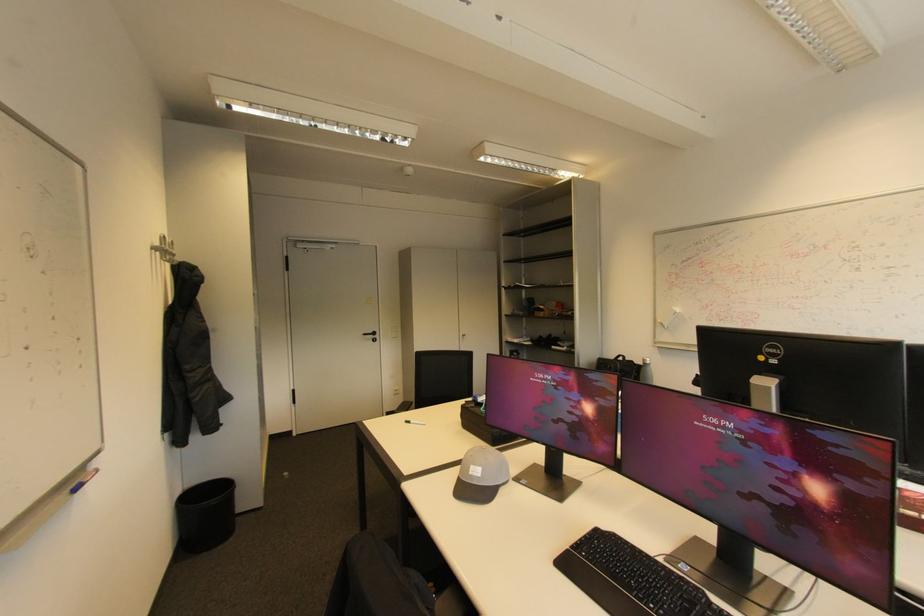
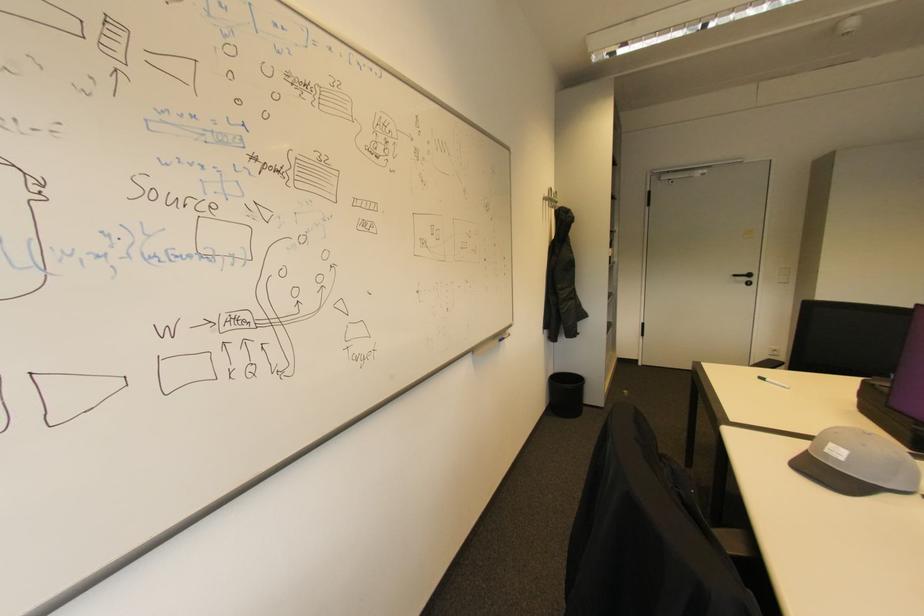
Question: Based on the continuous images, in which direction is the camera rotating? Reply with the corresponding letter.

Choices:
 (A) Left
 (B) Right
 (C) Up
 (D) Down

Answer: (A)